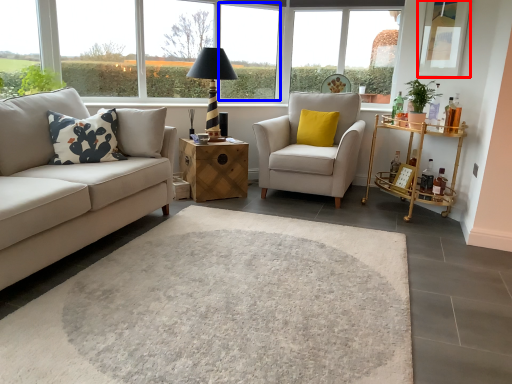
Question: Which object appears farthest to the camera in this image, window screen (highlighted by a red box) or window frame (highlighted by a blue box)?

Choices:
 (A) window screen
 (B) window frame

Answer: (B)